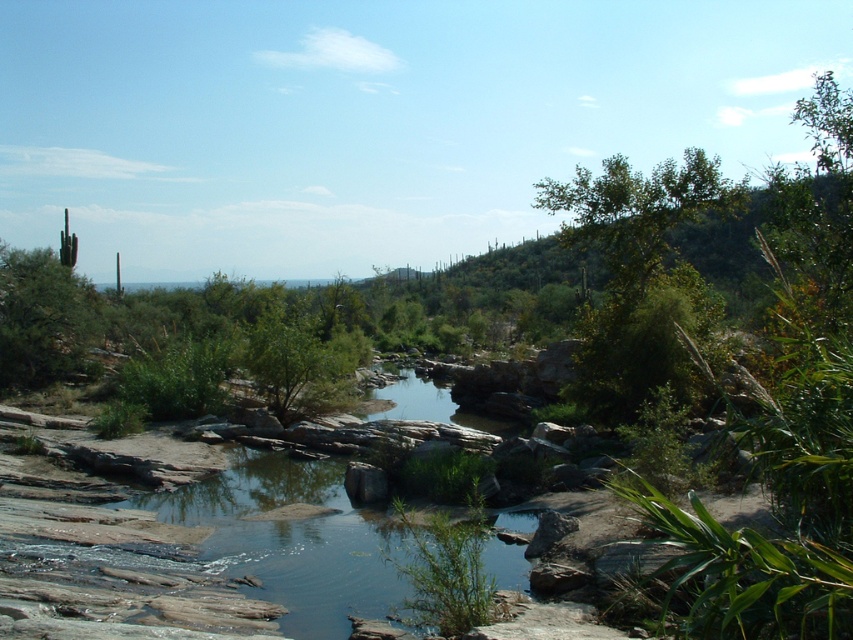
You are planning to set up a tent in this landscape. Which object, the green leafy tree at upper right or the green spiky cactus at upper left, would be closer to the ground level if you want to place your tent near the stream?

The green spiky cactus at upper left is closer to the ground level since the green leafy tree at upper right is positioned above it.

You are planning a hiking route and need to decide between two landmarks visible from your current position. The green leafy tree at upper right and the green spiky cactus at upper left are both in sight. Which landmark is bigger in size?

The green leafy tree at upper right is larger in size than the green spiky cactus at upper left, so the green leafy tree at upper right is bigger.